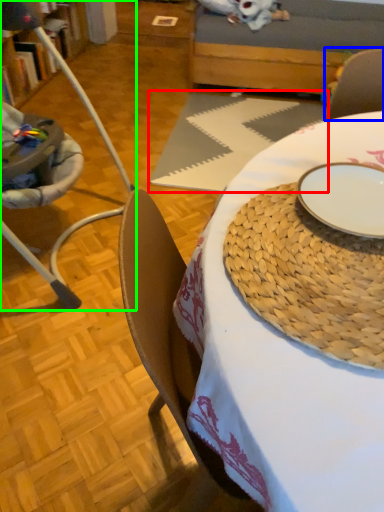
Question: Considering the real-world distances, which object is farthest from tablecloth (highlighted by a red box)? armchair (highlighted by a blue box) or chair (highlighted by a green box)?

Choices:
 (A) armchair
 (B) chair

Answer: (A)